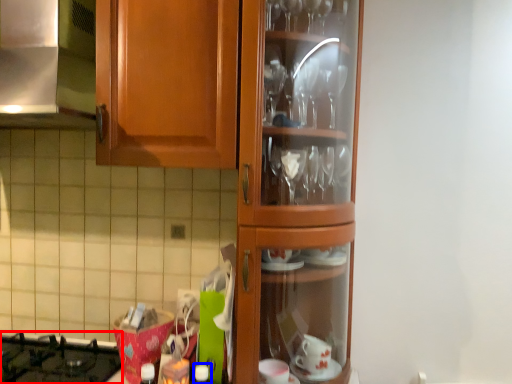
Question: Which object is closer to the camera taking this photo, gas stove (highlighted by a red box) or bottle (highlighted by a blue box)?

Choices:
 (A) gas stove
 (B) bottle

Answer: (B)